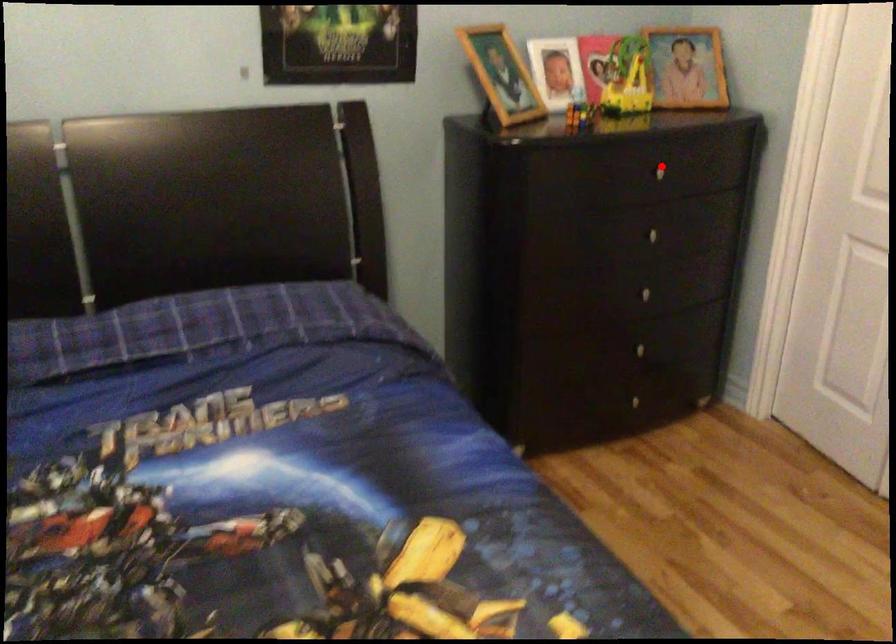
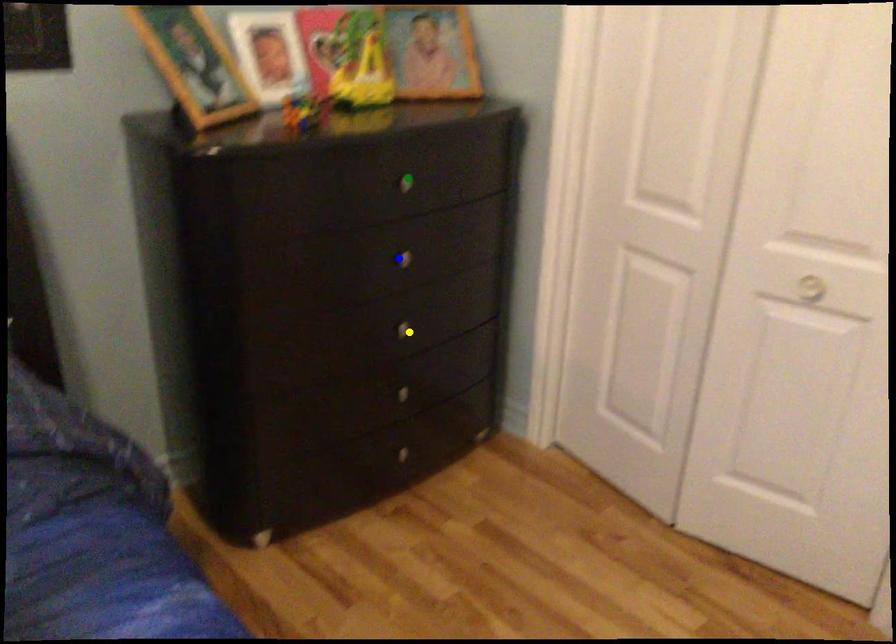
Question: I am providing you with two images of the same scene from different viewpoints. A red point is marked on the first image. You are given multiple points on the second image. Can you choose the point in image 2 that corresponds to the point in image 1?

Choices:
 (A) blue point
 (B) yellow point
 (C) green point

Answer: (C)